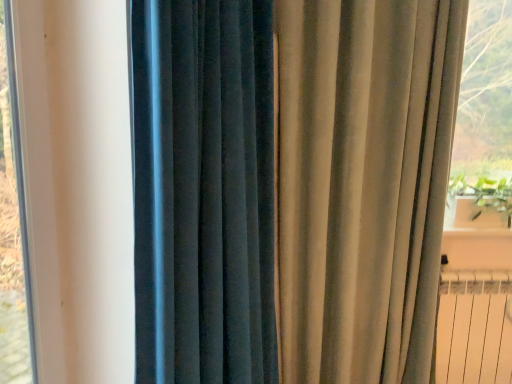
Question: Would you say green leafy plant at right is a long distance from white metallic radiator at lower right?

Choices:
 (A) yes
 (B) no

Answer: (B)

Question: Is white metallic radiator at lower right at the back of green leafy plant at right?

Choices:
 (A) no
 (B) yes

Answer: (A)

Question: From a real-world perspective, is green leafy plant at right over white metallic radiator at lower right?

Choices:
 (A) no
 (B) yes

Answer: (B)

Question: Can you confirm if green leafy plant at right is smaller than white metallic radiator at lower right?

Choices:
 (A) yes
 (B) no

Answer: (B)

Question: Does green leafy plant at right appear on the right side of white metallic radiator at lower right?

Choices:
 (A) yes
 (B) no

Answer: (A)

Question: From a real-world perspective, is green leafy plant at right beneath white metallic radiator at lower right?

Choices:
 (A) no
 (B) yes

Answer: (A)

Question: From the image's perspective, is satin beige curtain at right, which is the 2th curtain in left-to-right order, on top of white plastic window frame at left?

Choices:
 (A) no
 (B) yes

Answer: (A)

Question: Considering the relative sizes of satin beige curtain at right, which is the 2th curtain in left-to-right order, and white plastic window frame at left in the image provided, is satin beige curtain at right, which is the 2th curtain in left-to-right order, smaller than white plastic window frame at left?

Choices:
 (A) yes
 (B) no

Answer: (B)

Question: Could you tell me if satin beige curtain at right, which is the 2th curtain in left-to-right order, is facing white plastic window frame at left?

Choices:
 (A) no
 (B) yes

Answer: (A)

Question: Is satin beige curtain at right, the 1th curtain viewed from the right, shorter than white plastic window frame at left?

Choices:
 (A) yes
 (B) no

Answer: (B)

Question: Is satin beige curtain at right, the 1th curtain viewed from the right, located outside white plastic window frame at left?

Choices:
 (A) no
 (B) yes

Answer: (B)

Question: Is satin beige curtain at right, which is the 2th curtain in left-to-right order, positioned far away from white plastic window frame at left?

Choices:
 (A) yes
 (B) no

Answer: (B)

Question: Does green leafy plant at right come in front of satin beige curtain at right, the 1th curtain viewed from the right?

Choices:
 (A) no
 (B) yes

Answer: (A)